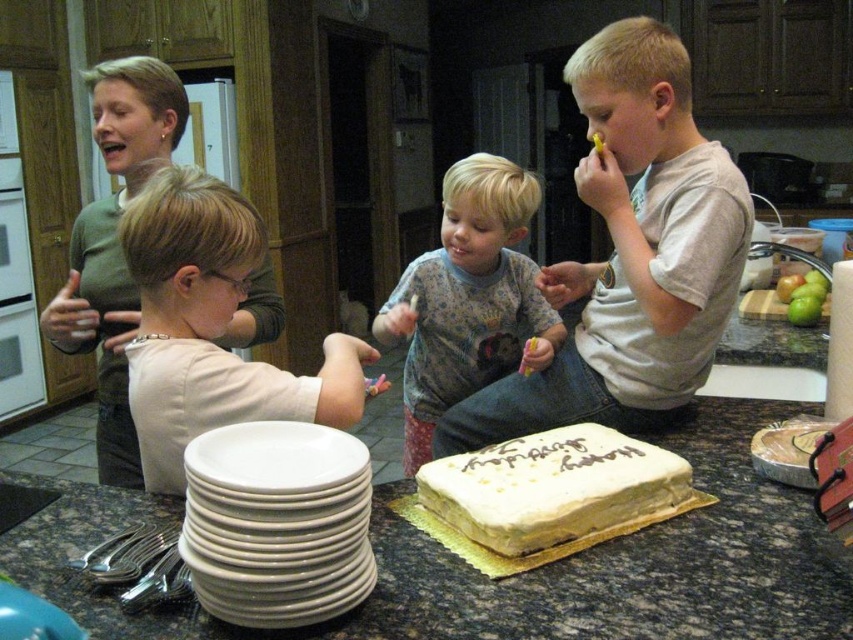
Between point (125, 250) and point (312, 499), which one is positioned behind?

The point (125, 250) is behind.

Which is in front, point (132, 416) or point (184, 561)?

Point (184, 561) is in front.

Where is `light beige shirt at left`? The image size is (853, 640). light beige shirt at left is located at coordinates (210, 326).

How distant is light gray t-shirt at center from gray cotton shirt at center?

light gray t-shirt at center is 9.04 inches from gray cotton shirt at center.

Does light gray t-shirt at center have a larger size compared to gray cotton shirt at center?

Correct, light gray t-shirt at center is larger in size than gray cotton shirt at center.

Is point (701, 136) positioned before point (490, 160)?

No, (701, 136) is further to viewer.

The width and height of the screenshot is (853, 640). I want to click on light gray t-shirt at center, so click(630, 256).

Is light gray t-shirt at center taller than light beige shirt at left?

Yes.

Does light gray t-shirt at center come in front of light beige shirt at left?

No, light gray t-shirt at center is further to the viewer.

Where is `light gray t-shirt at center`? light gray t-shirt at center is located at coordinates (630, 256).